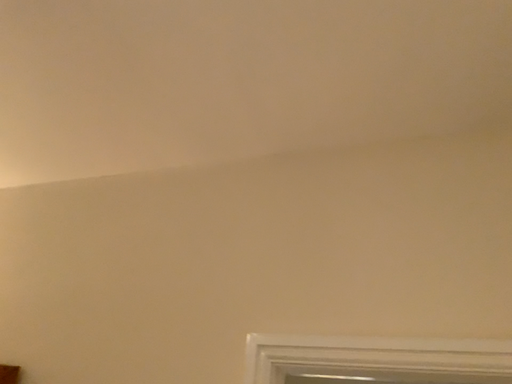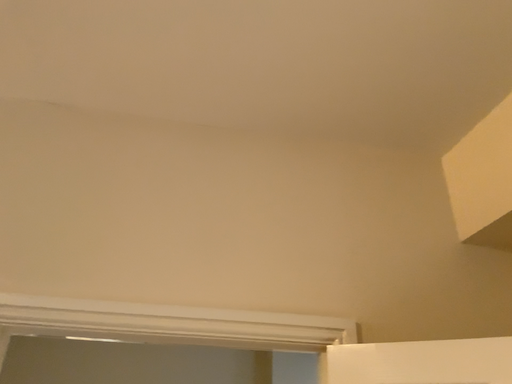
Question: How did the camera likely rotate when shooting the video?

Choices:
 (A) rotated right
 (B) rotated left

Answer: (A)